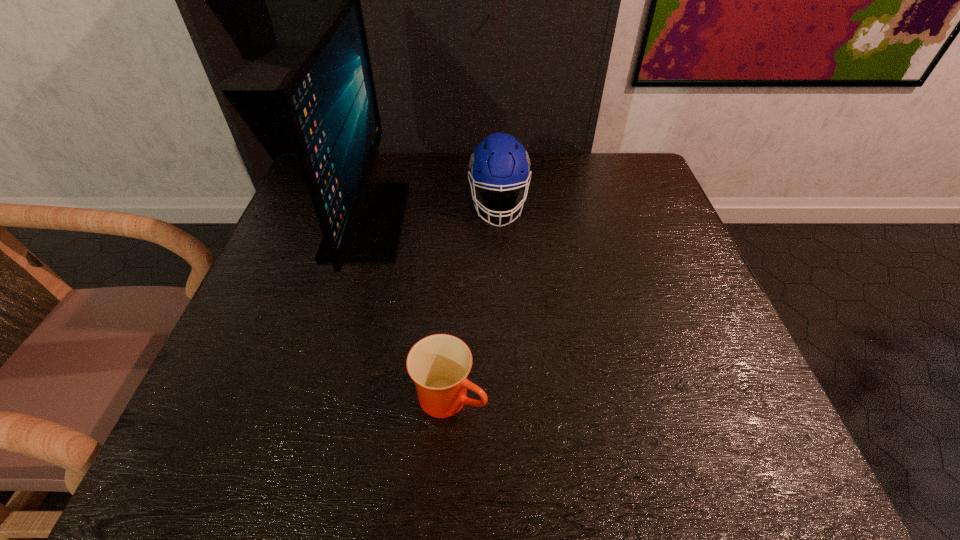
Locate an element on the screen. The width and height of the screenshot is (960, 540). object that is the second closest to the leftmost object is located at coordinates (439, 364).

Image resolution: width=960 pixels, height=540 pixels. Identify the location of free point that satisfies the following two spatial constraints: 1. on the back side of the nearest object; 2. on the screen side of the tallest object. (460, 221).

At what (x,y) coordinates should I click in order to perform the action: click on free region that satisfies the following two spatial constraints: 1. on the screen side of the monitor; 2. on the back side of the shortest object. Please return your answer as a coordinate pair (x, y). The height and width of the screenshot is (540, 960). Looking at the image, I should click on (318, 397).

This screenshot has width=960, height=540. I want to click on vacant region that satisfies the following two spatial constraints: 1. on the screen side of the monitor; 2. on the back side of the cup, so click(x=318, y=397).

Locate an element on the screen. vacant space that satisfies the following two spatial constraints: 1. on the back side of the cup; 2. on the screen side of the tallest object is located at coordinates (460, 221).

Image resolution: width=960 pixels, height=540 pixels. Find the location of `vacant region that satisfies the following two spatial constraints: 1. on the front-facing side of the football helmet; 2. on the screen side of the tallest object`. vacant region that satisfies the following two spatial constraints: 1. on the front-facing side of the football helmet; 2. on the screen side of the tallest object is located at coordinates (499, 221).

The height and width of the screenshot is (540, 960). Find the location of `free region that satisfies the following two spatial constraints: 1. on the screen side of the shortest object; 2. on the left side of the leftmost object`. free region that satisfies the following two spatial constraints: 1. on the screen side of the shortest object; 2. on the left side of the leftmost object is located at coordinates (318, 397).

You are a GUI agent. You are given a task and a screenshot of the screen. Output one action in this format:
    pyautogui.click(x=<x>, y=<y>)
    Task: Click on the vacant position in the image that satisfies the following two spatial constraints: 1. on the screen side of the tallest object; 2. on the right side of the cup
    The image size is (960, 540).
    Given the screenshot: What is the action you would take?
    pyautogui.click(x=318, y=397)

In order to click on free spot that satisfies the following two spatial constraints: 1. on the screen side of the monitor; 2. on the right side of the shortest object in this screenshot , I will do `click(318, 397)`.

In order to click on free spot that satisfies the following two spatial constraints: 1. on the front-facing side of the football helmet; 2. on the screen side of the leftmost object in this screenshot , I will do `click(499, 221)`.